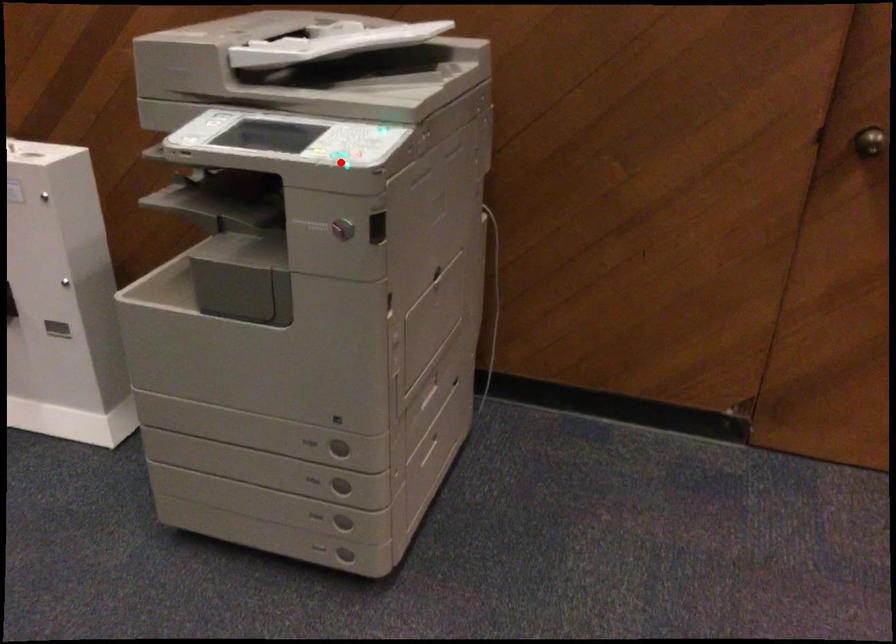
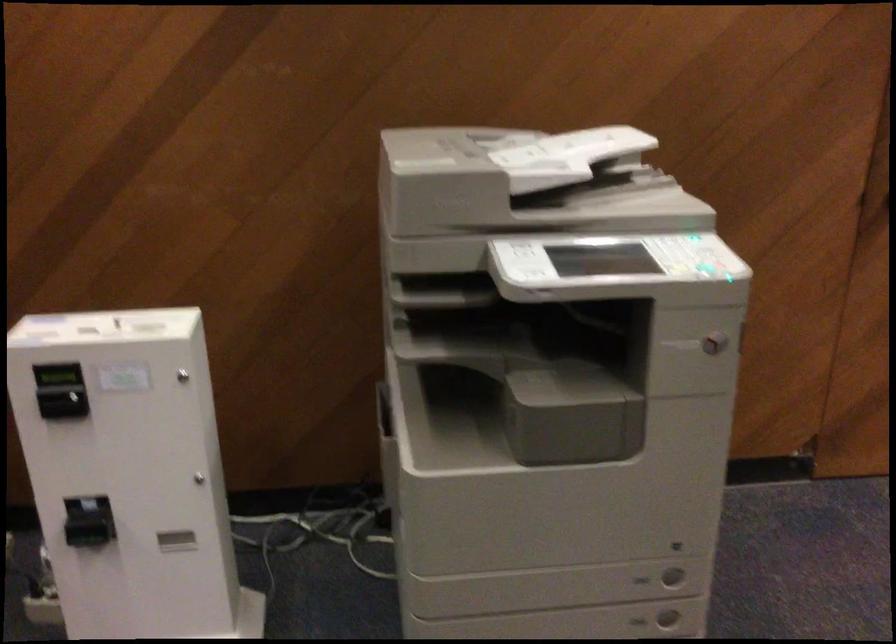
Find the pixel in the second image that matches the highlighted location in the first image.

(698, 266)